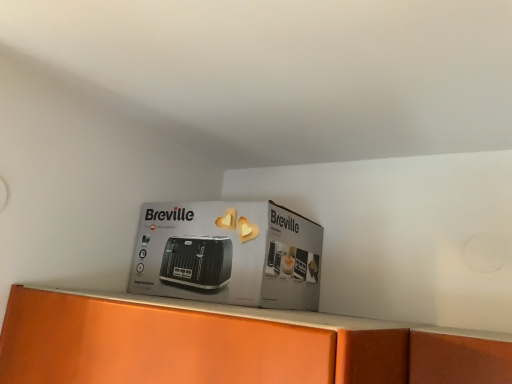
Question: Is matte black toaster at center shorter than black plastic toaster at center?

Choices:
 (A) no
 (B) yes

Answer: (B)

Question: From a real-world perspective, does matte black toaster at center stand above black plastic toaster at center?

Choices:
 (A) no
 (B) yes

Answer: (B)

Question: Considering the relative sizes of matte black toaster at center and black plastic toaster at center in the image provided, is matte black toaster at center thinner than black plastic toaster at center?

Choices:
 (A) yes
 (B) no

Answer: (A)

Question: Is matte black toaster at center looking in the opposite direction of black plastic toaster at center?

Choices:
 (A) no
 (B) yes

Answer: (B)

Question: Is matte black toaster at center closer to the viewer compared to black plastic toaster at center?

Choices:
 (A) no
 (B) yes

Answer: (B)

Question: Considering the relative sizes of matte black toaster at center and black plastic toaster at center in the image provided, is matte black toaster at center bigger than black plastic toaster at center?

Choices:
 (A) yes
 (B) no

Answer: (B)

Question: Can you confirm if black plastic toaster at center is thinner than matte black toaster at center?

Choices:
 (A) no
 (B) yes

Answer: (A)

Question: Is black plastic toaster at center looking in the opposite direction of matte black toaster at center?

Choices:
 (A) yes
 (B) no

Answer: (B)

Question: From the image's perspective, is black plastic toaster at center on matte black toaster at center?

Choices:
 (A) no
 (B) yes

Answer: (A)

Question: Can you confirm if black plastic toaster at center is taller than matte black toaster at center?

Choices:
 (A) no
 (B) yes

Answer: (B)

Question: Does black plastic toaster at center have a smaller size compared to matte black toaster at center?

Choices:
 (A) no
 (B) yes

Answer: (A)

Question: From the image's perspective, is black plastic toaster at center under matte black toaster at center?

Choices:
 (A) yes
 (B) no

Answer: (A)

Question: Is matte black toaster at center wider or thinner than black plastic toaster at center?

Choices:
 (A) wide
 (B) thin

Answer: (B)